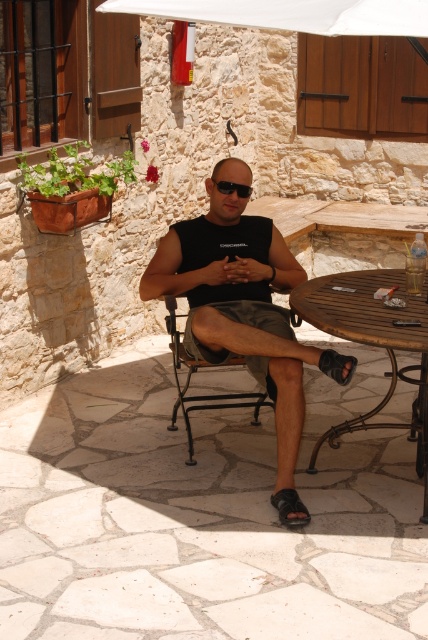
Question: Is black leather sandal at lower center closer to the viewer compared to black reflective sunglasses at center?

Choices:
 (A) no
 (B) yes

Answer: (B)

Question: Estimate the real-world distances between objects in this image. Which object is closer to the black reflective sunglasses at center?

Choices:
 (A) wooden table at center
 (B) black matte tank top at center

Answer: (B)

Question: Which of these objects is positioned closest to the black reflective sunglasses at center?

Choices:
 (A) black leather sandal at lower center
 (B) wooden table at center

Answer: (B)

Question: Is black matte tank top at center above black reflective sunglasses at center?

Choices:
 (A) yes
 (B) no

Answer: (B)

Question: Can you confirm if black matte tank top at center is thinner than black leather sandal at lower center?

Choices:
 (A) yes
 (B) no

Answer: (B)

Question: Based on their relative distances, which object is nearer to the black matte tank top at center?

Choices:
 (A) black leather sandal at lower center
 (B) gray cotton shorts at center
 (C) black reflective sunglasses at center

Answer: (B)